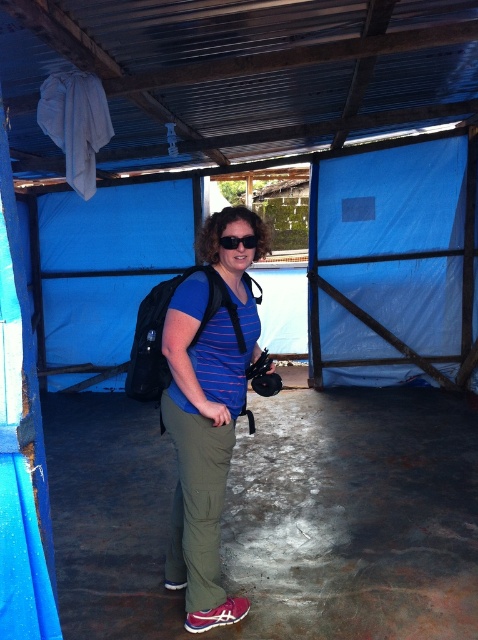
Question: Observing the image, what is the correct spatial positioning of matte blue shirt at center in reference to black matte sunglasses at center?

Choices:
 (A) below
 (B) above

Answer: (A)

Question: Is matte blue shirt at center above black matte sunglasses at center?

Choices:
 (A) yes
 (B) no

Answer: (B)

Question: Which point is closer to the camera?

Choices:
 (A) 175,328
 (B) 249,236

Answer: (A)

Question: Does matte blue shirt at center have a smaller size compared to black matte sunglasses at center?

Choices:
 (A) no
 (B) yes

Answer: (A)